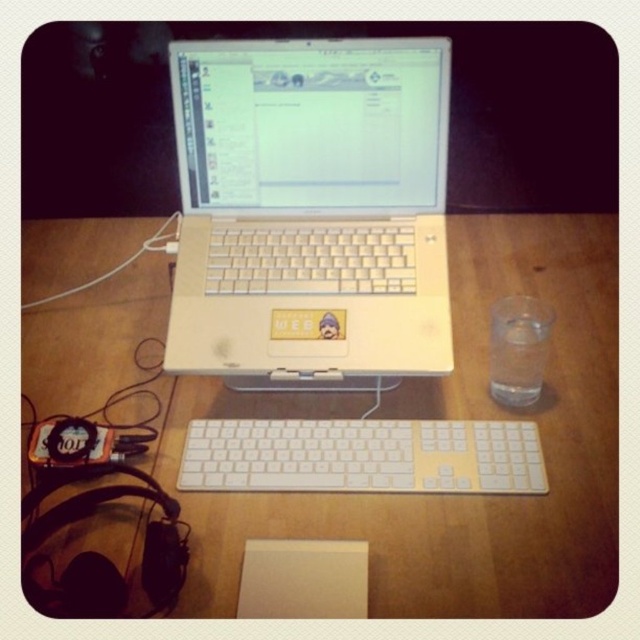
You are organizing your desk and need to place a new 12 centimeter wide notebook between the wooden table at center and the white plastic keyboard at center. Is there enough space to fit the notebook without moving either object?

The distance between the wooden table at center and the white plastic keyboard at center is 13.16 centimeters. Since the notebook is 12 centimeters wide, it should fit comfortably within the space without needing to move either object.